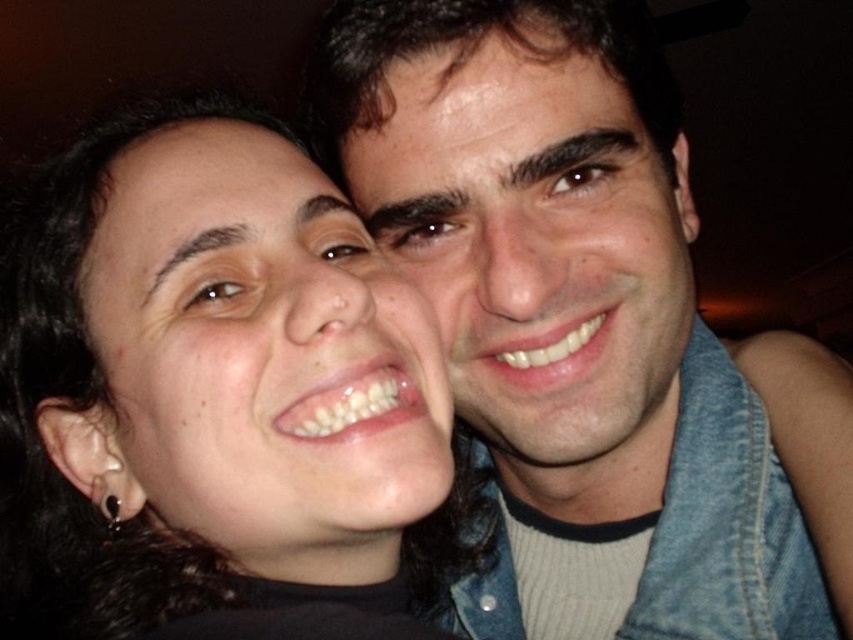
Who is lower down, matte blue shirt at upper right or smooth skin face at center?

matte blue shirt at upper right is lower down.

Which is more to the left, matte blue shirt at upper right or smooth skin face at center?

From the viewer's perspective, matte blue shirt at upper right appears more on the left side.

You are a GUI agent. You are given a task and a screenshot of the screen. Output one action in this format:
    pyautogui.click(x=<x>, y=<y>)
    Task: Click on the matte blue shirt at upper right
    
    Given the screenshot: What is the action you would take?
    pyautogui.click(x=584, y=323)

Between matte blue shirt at upper right and matte skin face at center, which one has more height?

With more height is matte blue shirt at upper right.

Who is more forward, (560, 45) or (219, 310)?

Point (219, 310) is in front.

Locate an element on the screen. matte blue shirt at upper right is located at coordinates (584, 323).

Does matte skin face at center have a smaller size compared to smooth skin face at center?

Yes.

You are a GUI agent. You are given a task and a screenshot of the screen. Output one action in this format:
    pyautogui.click(x=<x>, y=<y>)
    Task: Click on the matte skin face at center
    
    Given the screenshot: What is the action you would take?
    pyautogui.click(x=254, y=353)

The image size is (853, 640). What are the coordinates of `matte skin face at center` in the screenshot? It's located at (254, 353).

Find the location of a particular element. This screenshot has height=640, width=853. matte skin face at center is located at coordinates (254, 353).